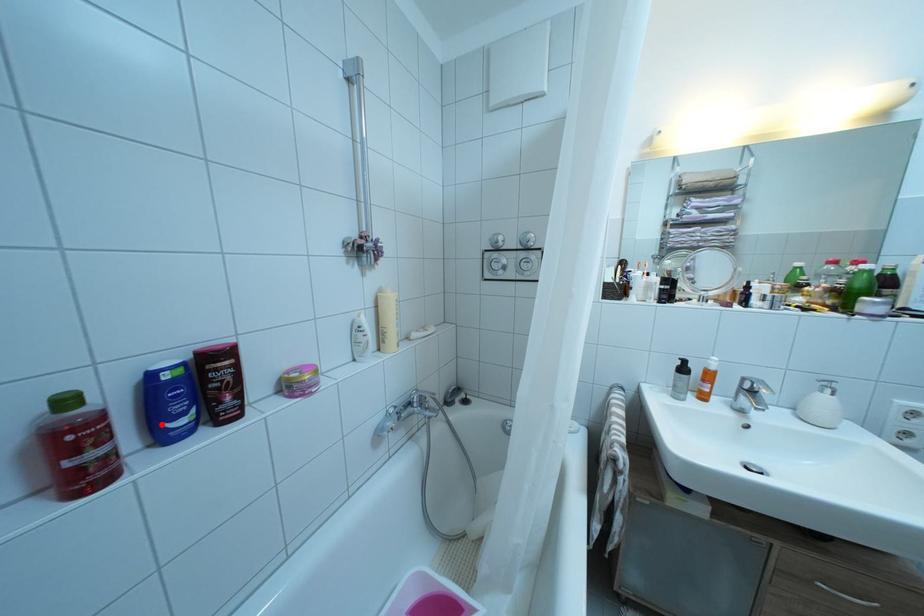
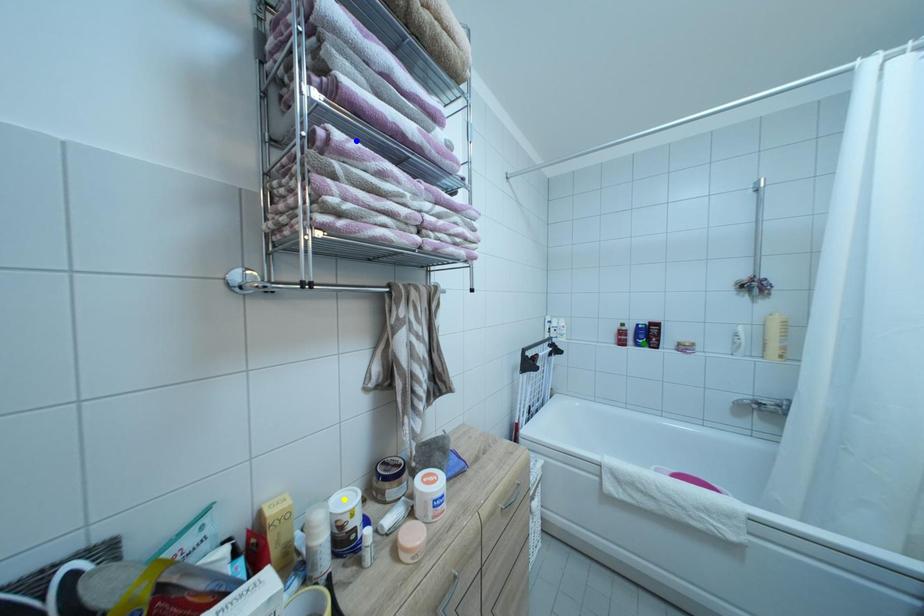
Question: I am providing you with two images of the same scene from different viewpoints. A red point is marked on the first image. You are given multiple points on the second image. Can you choose the point in image 2 that corresponds to the point in image 1?

Choices:
 (A) blue point
 (B) green point
 (C) yellow point

Answer: (B)